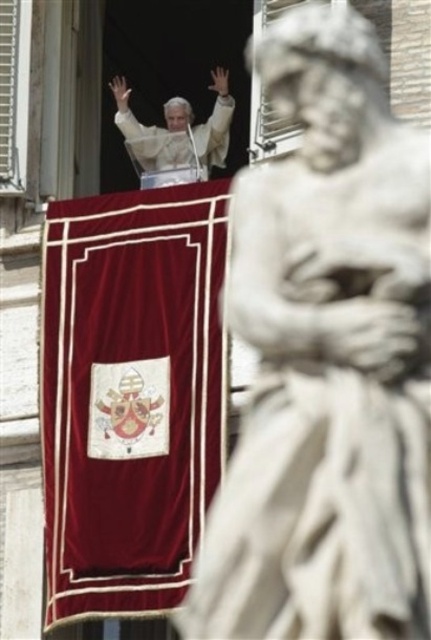
Consider the image. You are an architect designing a new chapel and want to replicate the arrangement of the white marble statue at center and the velvet red curtain at center seen in the image. Based on the scene, which object should be placed higher?

The white marble statue at center should be placed higher as it is positioned above the velvet red curtain at center in the original scene.

You are an architect designing a new chapel and want to place a statue in front of the velvet red curtain at center. According to the image, where should the statue be positioned relative to the curtain?

The velvet red curtain at center is located at coordinates point (x=130, y=394). To place the statue in front of it, the statue should be positioned in front of the curtain at those coordinates.